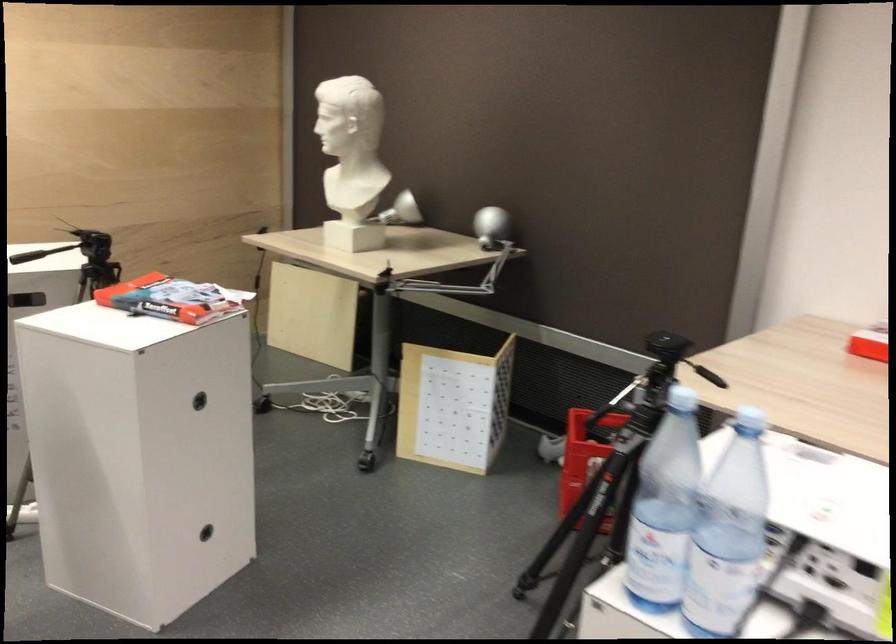
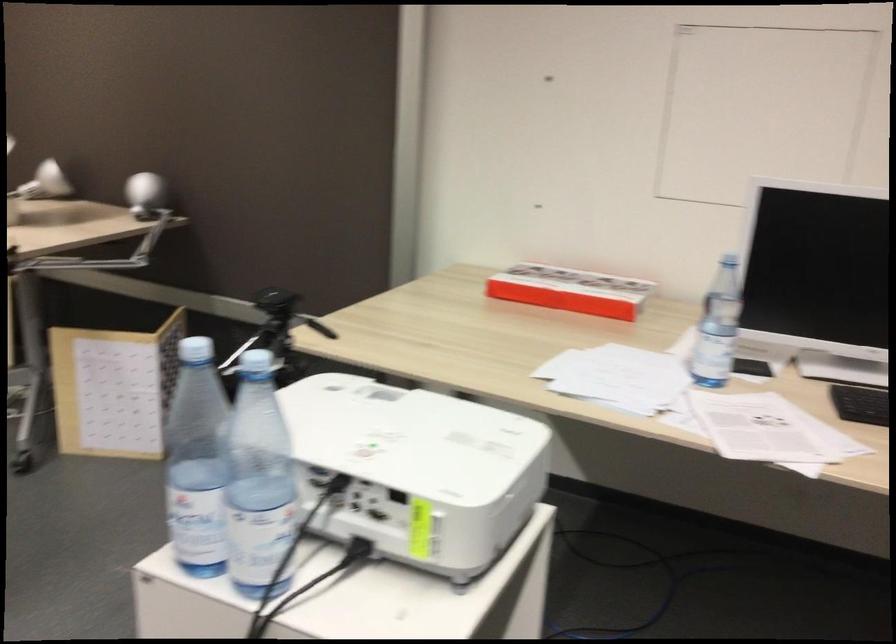
In the second image, find the point that corresponds to (669,500) in the first image.

(195, 462)